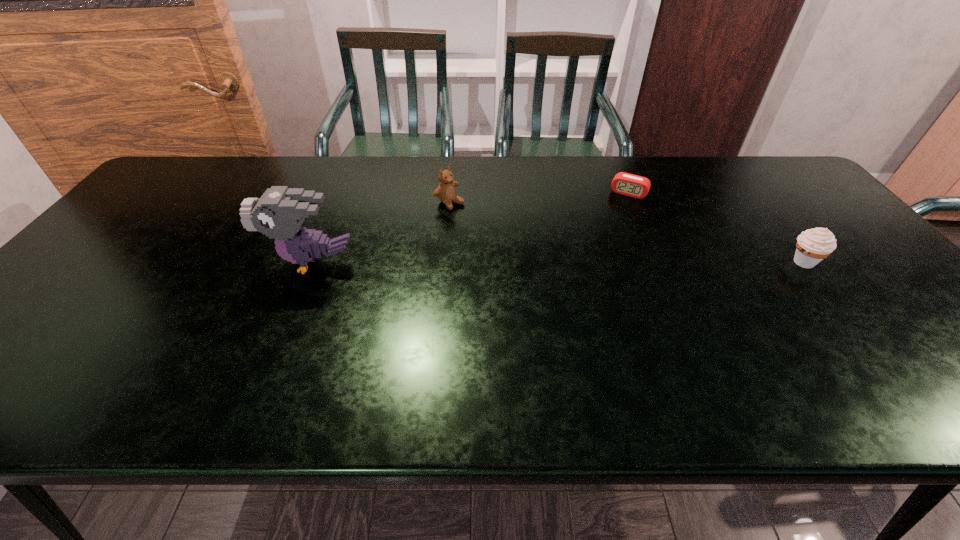
In the image, there is a desktop. Identify the location of free space at the near edge. This screenshot has height=540, width=960. (156, 343).

Locate an element on the screen. vacant region at the left edge of the desktop is located at coordinates (149, 239).

This screenshot has height=540, width=960. I want to click on vacant space at the right edge, so click(920, 313).

You are a GUI agent. You are given a task and a screenshot of the screen. Output one action in this format:
    pyautogui.click(x=<x>, y=<y>)
    Task: Click on the vacant space at the far right corner
    
    Given the screenshot: What is the action you would take?
    tap(790, 177)

Identify the location of vacant space at the near right corner of the desktop. (916, 339).

Locate an element on the screen. This screenshot has width=960, height=540. unoccupied position between the bird and the rightmost object is located at coordinates (558, 262).

Locate an element on the screen. The height and width of the screenshot is (540, 960). free space that is in between the muffin and the teddy bear is located at coordinates (626, 233).

Locate an element on the screen. empty space that is in between the leftmost object and the shortest object is located at coordinates (470, 228).

Where is `free spot between the alarm clock and the rightmost object`? The height and width of the screenshot is (540, 960). free spot between the alarm clock and the rightmost object is located at coordinates (716, 227).

At what (x,y) coordinates should I click in order to perform the action: click on vacant space that's between the third object from right to left and the rightmost object. Please return your answer as a coordinate pair (x, y). The image size is (960, 540). Looking at the image, I should click on pos(626,233).